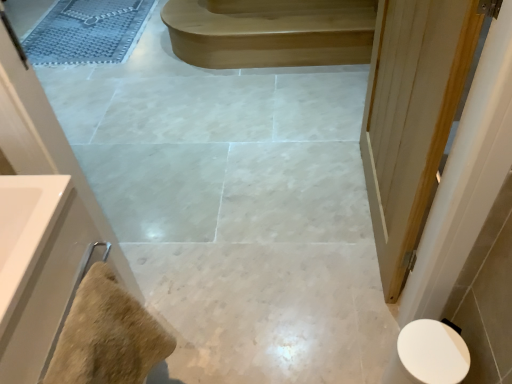
Question: Does white glossy toilet at lower right have a lesser width compared to beige textured towel at lower left?

Choices:
 (A) yes
 (B) no

Answer: (B)

Question: Is white glossy toilet at lower right to the left of beige textured towel at lower left from the viewer's perspective?

Choices:
 (A) yes
 (B) no

Answer: (B)

Question: Could you tell me if white glossy toilet at lower right is facing beige textured towel at lower left?

Choices:
 (A) yes
 (B) no

Answer: (B)

Question: From the image's perspective, is white glossy toilet at lower right beneath beige textured towel at lower left?

Choices:
 (A) no
 (B) yes

Answer: (B)

Question: Is white glossy toilet at lower right next to beige textured towel at lower left and touching it?

Choices:
 (A) yes
 (B) no

Answer: (B)

Question: Can we say white glossy toilet at lower right lies outside beige textured towel at lower left?

Choices:
 (A) yes
 (B) no

Answer: (A)

Question: From a real-world perspective, is white wood door at right under white glossy toilet at lower right?

Choices:
 (A) no
 (B) yes

Answer: (A)

Question: Are white wood door at right and white glossy toilet at lower right beside each other?

Choices:
 (A) no
 (B) yes

Answer: (A)

Question: Is white glossy toilet at lower right completely or partially inside white wood door at right?

Choices:
 (A) no
 (B) yes

Answer: (A)

Question: Is white wood door at right closer to camera compared to white glossy toilet at lower right?

Choices:
 (A) no
 (B) yes

Answer: (B)

Question: Considering the relative sizes of white wood door at right and white glossy toilet at lower right in the image provided, is white wood door at right shorter than white glossy toilet at lower right?

Choices:
 (A) yes
 (B) no

Answer: (B)

Question: Considering the relative sizes of white wood door at right and white glossy toilet at lower right in the image provided, is white wood door at right smaller than white glossy toilet at lower right?

Choices:
 (A) yes
 (B) no

Answer: (B)

Question: Is light brown wood stair at upper center located outside beige textured towel at lower left?

Choices:
 (A) no
 (B) yes

Answer: (B)